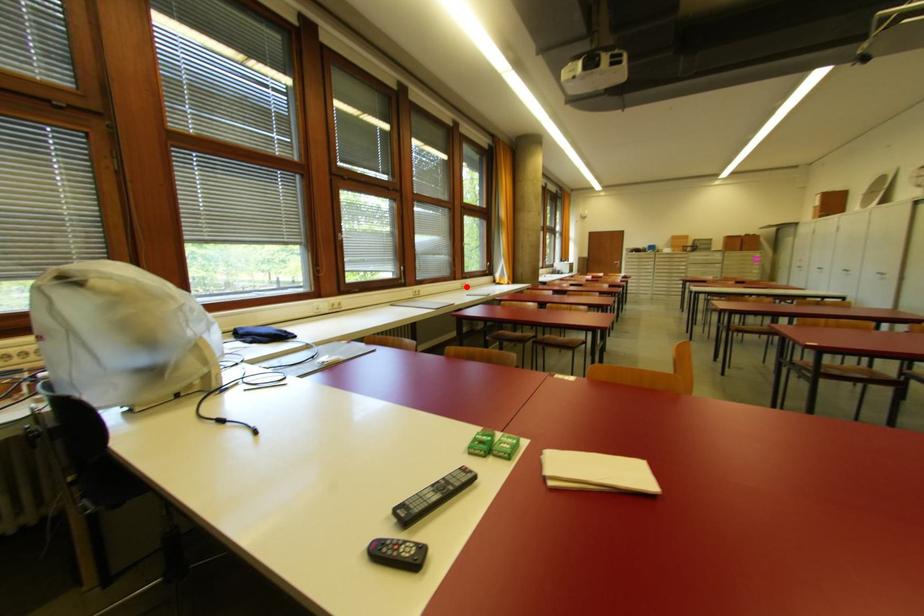
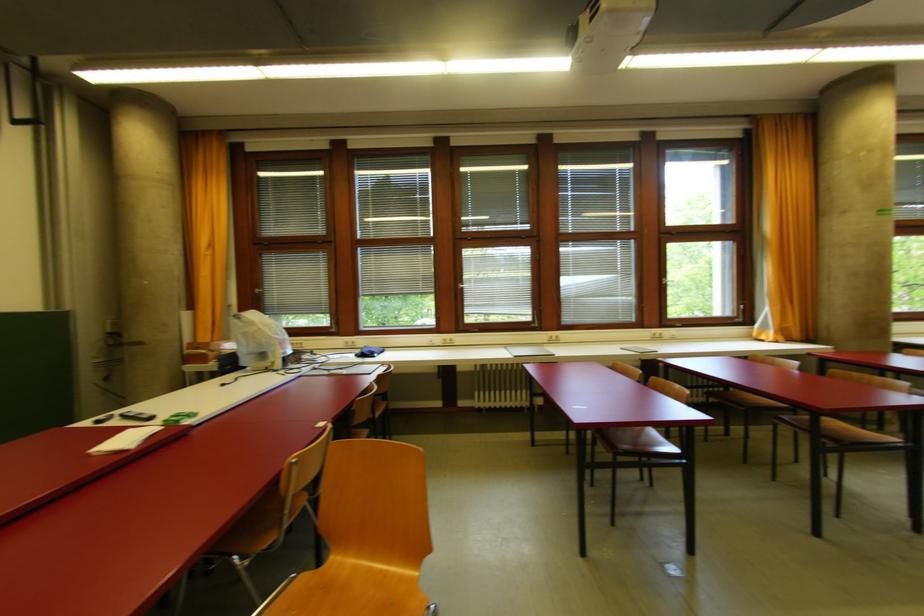
Locate, in the second image, the point that corresponds to the highlighted location in the first image.

(660, 338)